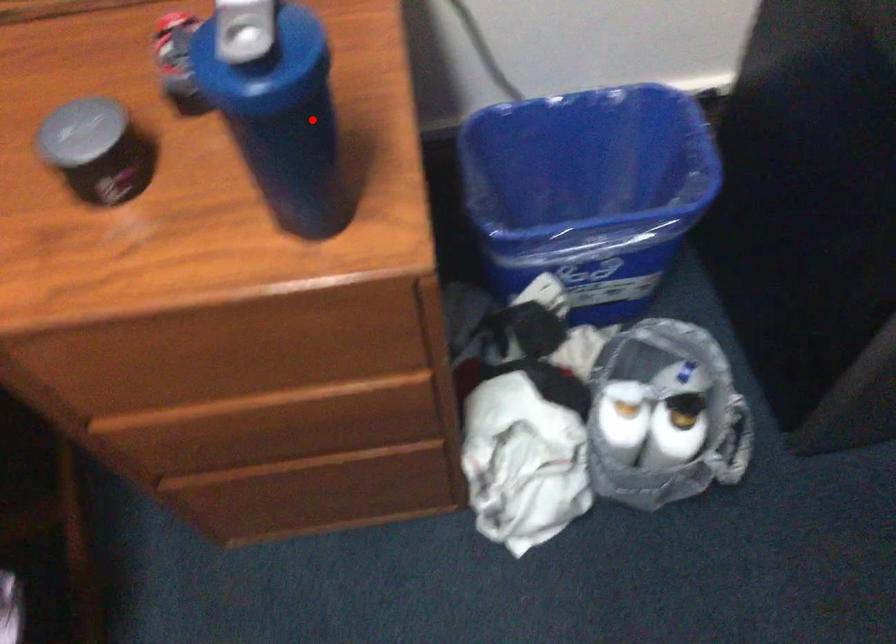
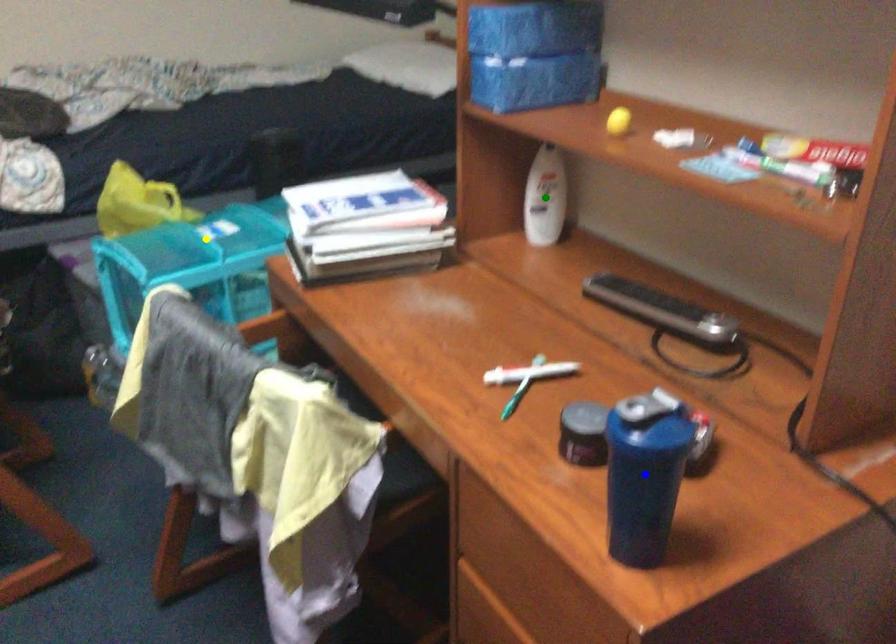
Question: I am providing you with two images of the same scene from different viewpoints. A red point is marked on the first image. You are given multiple points on the second image. Which point in image 2 represents the same 3d spot as the red point in image 1?

Choices:
 (A) yellow point
 (B) green point
 (C) blue point

Answer: (C)